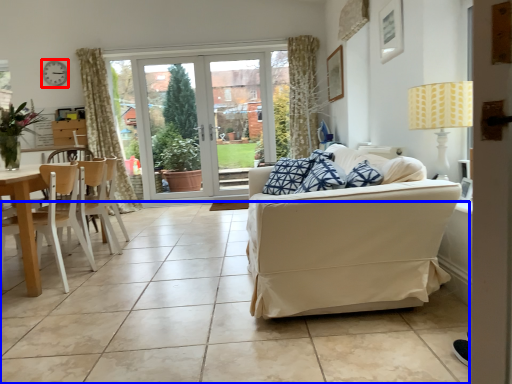
Question: Which of the following is the farthest to the observer, clock (highlighted by a red box) or ceramic tile (highlighted by a blue box)?

Choices:
 (A) clock
 (B) ceramic tile

Answer: (A)